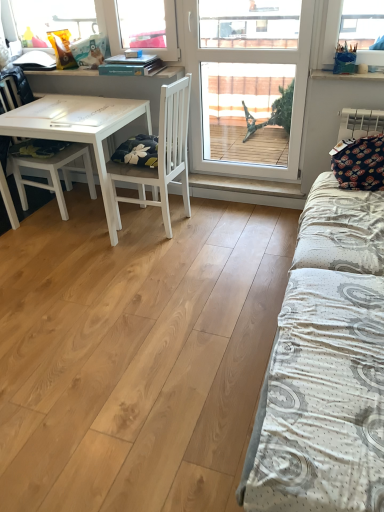
Question: From the image's perspective, is transparent glass window at center above dark blue fabric pillow at right?

Choices:
 (A) yes
 (B) no

Answer: (A)

Question: Is transparent glass window at center outside of dark blue fabric pillow at right?

Choices:
 (A) yes
 (B) no

Answer: (A)

Question: Can you confirm if transparent glass window at center is wider than dark blue fabric pillow at right?

Choices:
 (A) yes
 (B) no

Answer: (B)

Question: From a real-world perspective, is transparent glass window at center physically below dark blue fabric pillow at right?

Choices:
 (A) yes
 (B) no

Answer: (B)

Question: Are transparent glass window at center and dark blue fabric pillow at right making contact?

Choices:
 (A) yes
 (B) no

Answer: (B)

Question: Is transparent glass window at center oriented away from dark blue fabric pillow at right?

Choices:
 (A) yes
 (B) no

Answer: (B)

Question: From the image's perspective, would you say white matte chair at center, arranged as the 1th chair when viewed from the right, is shown under white textured bed at right?

Choices:
 (A) no
 (B) yes

Answer: (A)

Question: Is white matte chair at center, arranged as the 1th chair when viewed from the right, taller than white textured bed at right?

Choices:
 (A) no
 (B) yes

Answer: (A)

Question: Is white matte chair at center, arranged as the 1th chair when viewed from the right, directly adjacent to white textured bed at right?

Choices:
 (A) yes
 (B) no

Answer: (B)

Question: Considering the relative positions of white matte chair at center, which ranks as the 2th chair in left-to-right order, and white textured bed at right in the image provided, is white matte chair at center, which ranks as the 2th chair in left-to-right order, to the left of white textured bed at right from the viewer's perspective?

Choices:
 (A) yes
 (B) no

Answer: (A)

Question: Does white matte chair at center, arranged as the 1th chair when viewed from the right, have a lesser height compared to white textured bed at right?

Choices:
 (A) yes
 (B) no

Answer: (A)

Question: Can you confirm if white matte chair at center, arranged as the 1th chair when viewed from the right, is wider than white textured bed at right?

Choices:
 (A) yes
 (B) no

Answer: (A)

Question: Considering the relative positions of white textured bed at right and white matte table at left in the image provided, is white textured bed at right to the left of white matte table at left from the viewer's perspective?

Choices:
 (A) yes
 (B) no

Answer: (B)